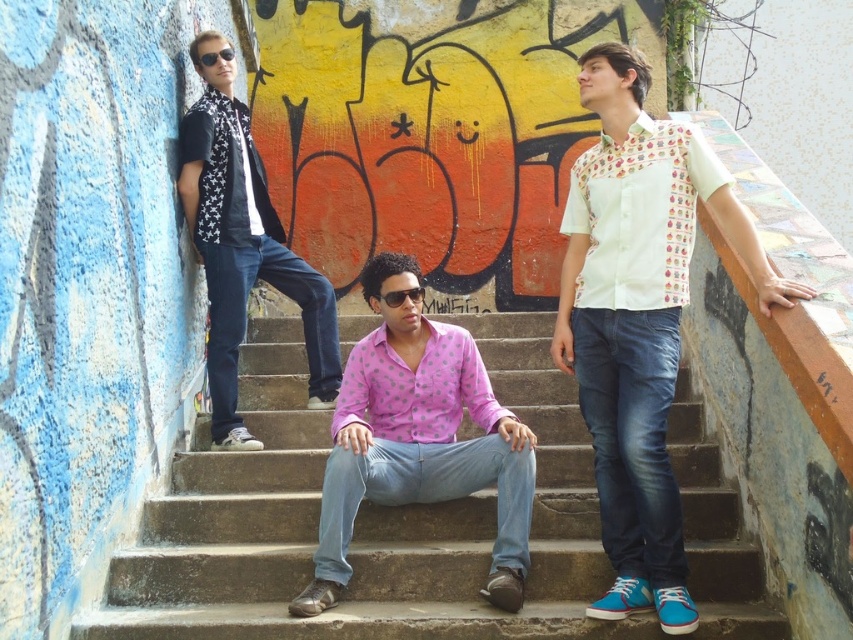
Question: Which object is farther from the camera taking this photo?

Choices:
 (A) smooth concrete stairs at center
 (B) pink dotted shirt at center
 (C) white printed shirt at right
 (D) matte black scarf at left

Answer: (D)

Question: Which is nearer to the matte black scarf at left?

Choices:
 (A) pink dotted shirt at center
 (B) smooth concrete stairs at center
 (C) white printed shirt at right

Answer: (B)

Question: Observing the image, what is the correct spatial positioning of white printed shirt at right in reference to matte black scarf at left?

Choices:
 (A) right
 (B) left

Answer: (A)

Question: Based on their relative distances, which object is farther from the white printed shirt at right?

Choices:
 (A) pink dotted shirt at center
 (B) matte black scarf at left
 (C) smooth concrete stairs at center

Answer: (B)

Question: Observing the image, what is the correct spatial positioning of white printed shirt at right in reference to pink dotted shirt at center?

Choices:
 (A) below
 (B) above

Answer: (B)

Question: Is pink dotted shirt at center closer to camera compared to matte black scarf at left?

Choices:
 (A) no
 (B) yes

Answer: (B)